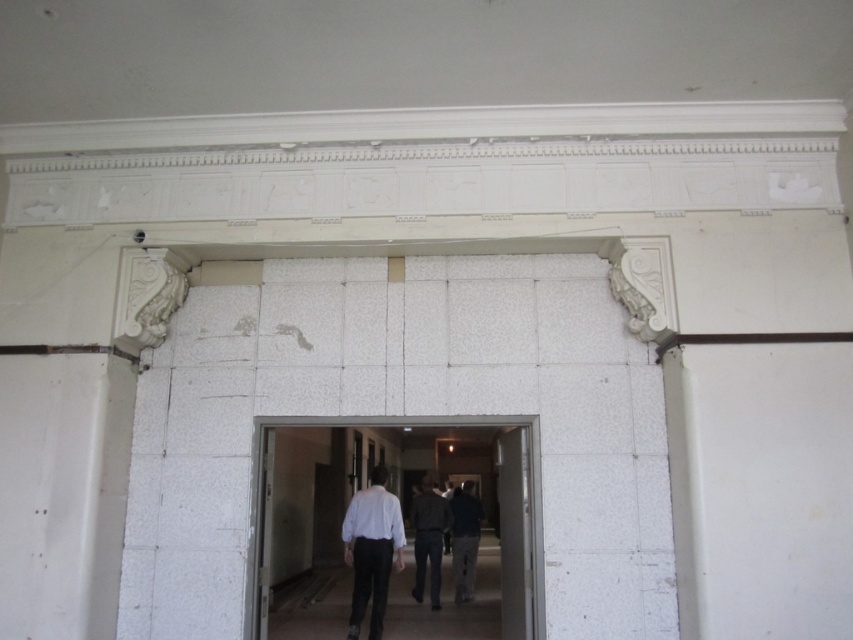
You are an interior designer observing the scene. You notice both the white matte shirt at center and the dark gray fabric jacket at center. Which clothing item takes up less space in the area?

The white matte shirt at center has a smaller size compared to the dark gray fabric jacket at center, so the white matte shirt at center takes up less space.

You are an interior designer observing the unfinished building. You notice the white textured door at center and the dark blue shirt at center. Which object takes up more space in the scene?

The white textured door at center is bigger than the dark blue shirt at center, so it takes up more space in the scene.

You are a tailor measuring two garments in the middle of a room. The white matte shirt at center and the dark gray fabric jacket at center are both placed on a table. Which garment has a larger width according to the description?

The white matte shirt at center might be wider than dark gray fabric jacket at center.